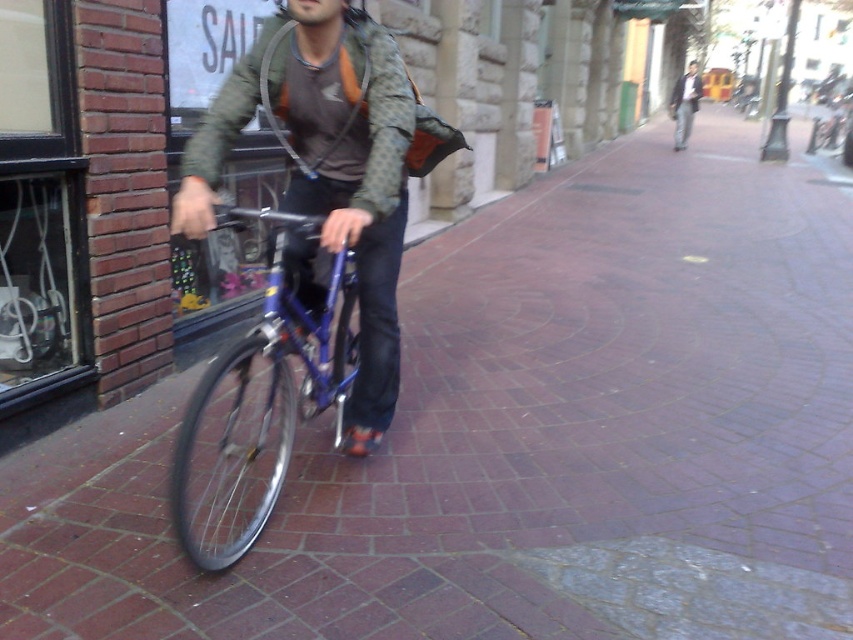
Question: Considering the real-world distances, which object is farthest from the shiny blue bicycle at center?

Choices:
 (A) brown fabric helmet at center
 (B) dark gray jacket at upper center

Answer: (B)

Question: Does matte blue bicycle at center come behind shiny blue bicycle at center?

Choices:
 (A) yes
 (B) no

Answer: (A)

Question: Which point is farther from the camera taking this photo?

Choices:
 (A) (350, 8)
 (B) (299, 29)

Answer: (B)

Question: Observing the image, what is the correct spatial positioning of shiny blue bicycle at center in reference to brown fabric helmet at center?

Choices:
 (A) left
 (B) right

Answer: (A)

Question: Is matte blue bicycle at center positioned before dark gray jacket at upper center?

Choices:
 (A) no
 (B) yes

Answer: (B)

Question: Which is nearer to the matte blue bicycle at center?

Choices:
 (A) brown fabric helmet at center
 (B) shiny blue bicycle at center

Answer: (B)